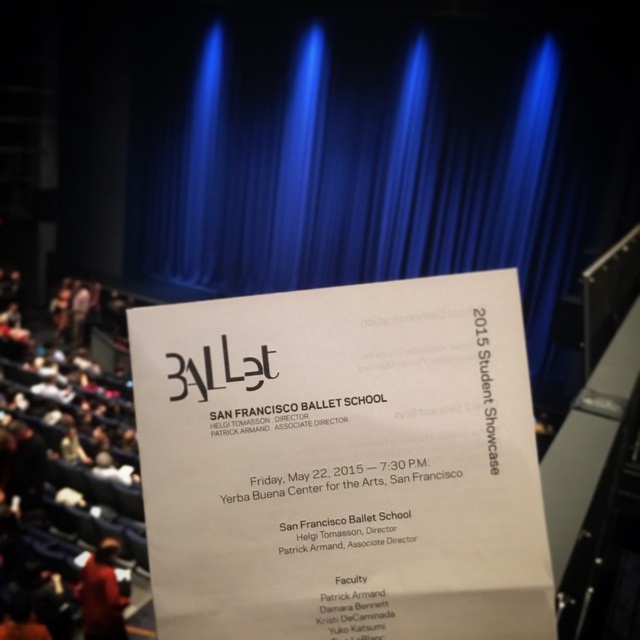
Question: Which point appears closest to the camera in this image?

Choices:
 (A) (122, 602)
 (B) (522, 72)

Answer: (A)

Question: Is blue velvet curtain at center closer to the viewer compared to red fabric hat at lower left?

Choices:
 (A) no
 (B) yes

Answer: (A)

Question: Which point appears closest to the camera in this image?

Choices:
 (A) (93, 573)
 (B) (204, 516)

Answer: (B)

Question: Considering the relative positions of blue velvet curtain at center and red fabric hat at lower left in the image provided, where is blue velvet curtain at center located with respect to red fabric hat at lower left?

Choices:
 (A) left
 (B) right

Answer: (B)

Question: Which is farther from the red fabric hat at lower left?

Choices:
 (A) white paper at center
 (B) blue velvet curtain at center

Answer: (A)

Question: From the image, what is the correct spatial relationship of white paper at center in relation to red fabric hat at lower left?

Choices:
 (A) above
 (B) below

Answer: (A)